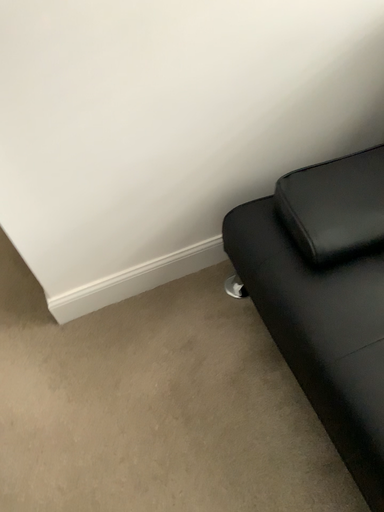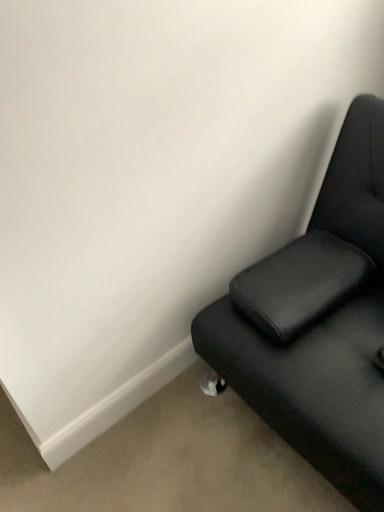
Question: Which way did the camera rotate in the video?

Choices:
 (A) rotated right
 (B) rotated left

Answer: (A)